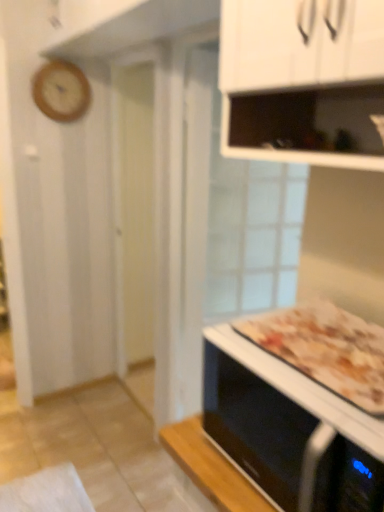
Locate an element on the screen. This screenshot has height=512, width=384. free spot above black glossy microwave oven at lower right (from a real-world perspective) is located at coordinates (314, 350).